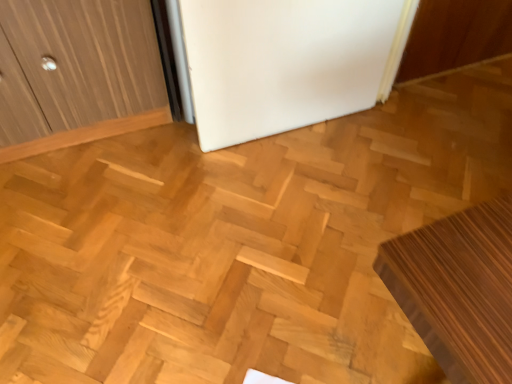
I want to click on vacant area that lies in front of white matte refrigerator at center, so click(x=285, y=211).